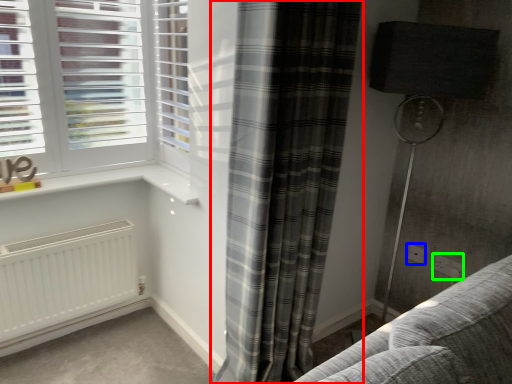
Question: Which object is positioned closest to curtain (highlighted by a red box)? Select from electric outlet (highlighted by a blue box) and electric outlet (highlighted by a green box).

Choices:
 (A) electric outlet
 (B) electric outlet

Answer: (A)